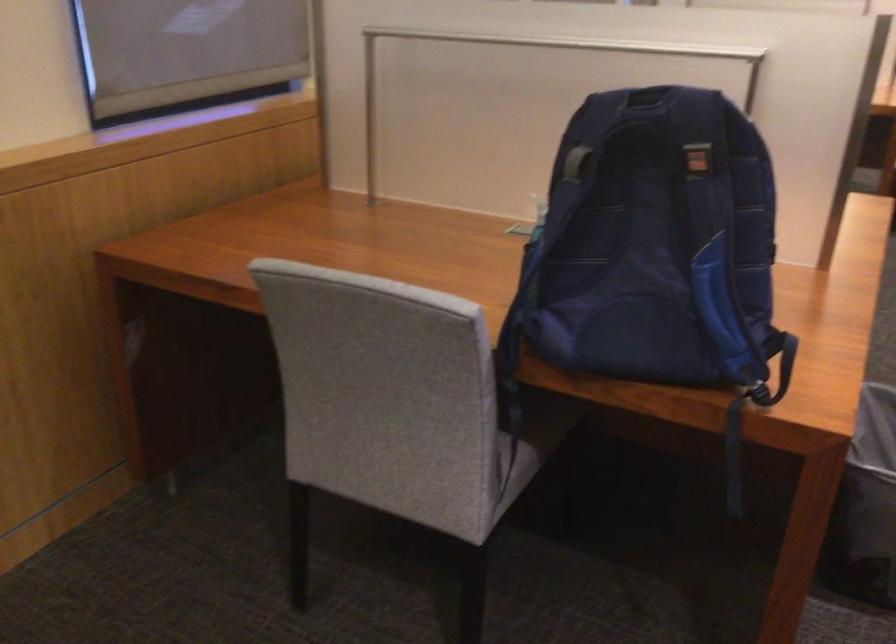
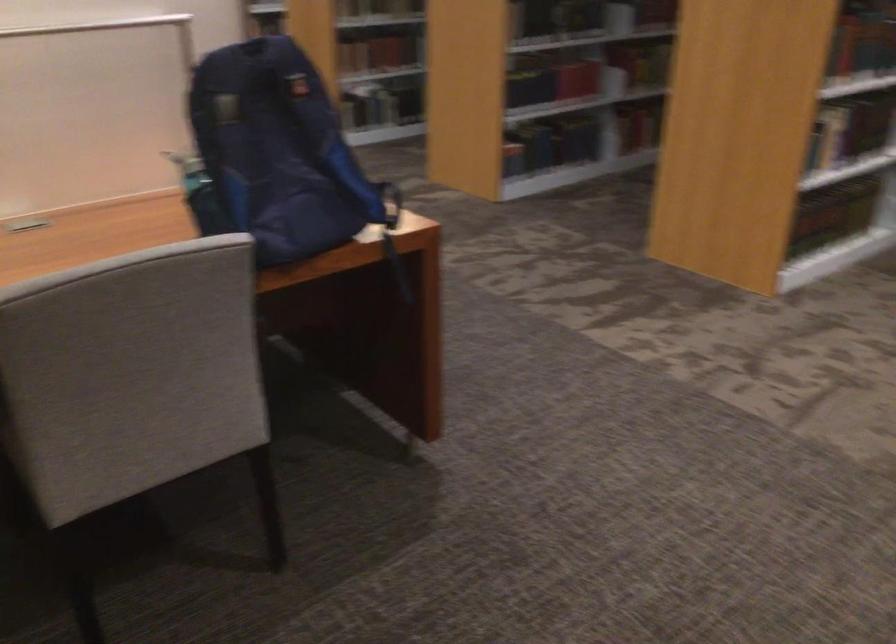
In the second image, find the point that corresponds to the point at 762,402 in the first image.

(392, 234)